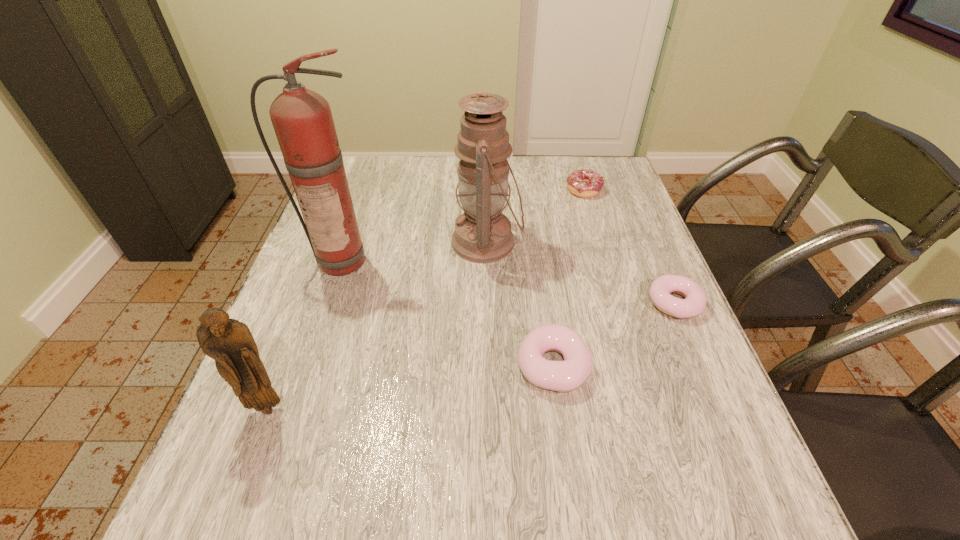
Locate an element on the screen. empty location between the farthest doughnut and the fifth shortest object is located at coordinates (535, 216).

You are a GUI agent. You are given a task and a screenshot of the screen. Output one action in this format:
    pyautogui.click(x=<x>, y=<y>)
    Task: Click on the unoccupied position between the leftmost doughnut and the third nearest object
    Image resolution: width=960 pixels, height=540 pixels.
    Given the screenshot: What is the action you would take?
    pyautogui.click(x=614, y=334)

At what (x,y) coordinates should I click in order to perform the action: click on unoccupied area between the oil lamp and the figurine. Please return your answer as a coordinate pair (x, y). The image size is (960, 540). Looking at the image, I should click on (377, 325).

The image size is (960, 540). I want to click on vacant region between the leftmost doughnut and the farthest doughnut, so click(x=568, y=278).

This screenshot has height=540, width=960. I want to click on blank region between the oil lamp and the third tallest object, so 377,325.

Find the location of a particular element. Image resolution: width=960 pixels, height=540 pixels. empty location between the oil lamp and the farthest object is located at coordinates (535, 216).

At what (x,y) coordinates should I click in order to perform the action: click on empty location between the rightmost doughnut and the farthest doughnut. Please return your answer as a coordinate pair (x, y). The height and width of the screenshot is (540, 960). Looking at the image, I should click on coord(630,246).

Choose which object is the nearest neighbor to the fourth farthest object. Please provide its 2D coordinates. Your answer should be formatted as a tuple, i.e. [(x, y)], where the tuple contains the x and y coordinates of a point satisfying the conditions above.

[(563, 376)]

Identify which object is the second closest to the fourth shortest object. Please provide its 2D coordinates. Your answer should be formatted as a tuple, i.e. [(x, y)], where the tuple contains the x and y coordinates of a point satisfying the conditions above.

[(563, 376)]

In order to click on doughnut identified as the second closest to the rightmost object in this screenshot , I will do `click(586, 183)`.